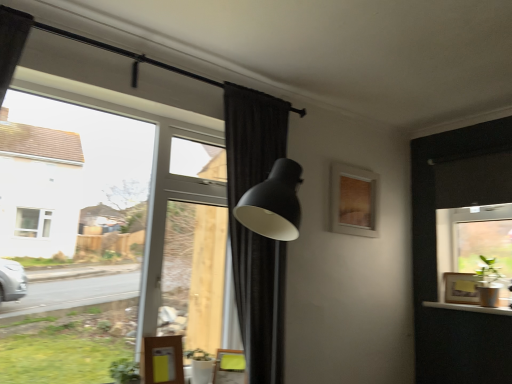
Question: Considering the relative sizes of yellow fabric swivel chair at lower center and transparent glass window at upper left, which is counted as the 2th window, starting from the right, in the image provided, is yellow fabric swivel chair at lower center wider than transparent glass window at upper left, which is counted as the 2th window, starting from the right,?

Choices:
 (A) no
 (B) yes

Answer: (A)

Question: Is the position of yellow fabric swivel chair at lower center less distant than that of transparent glass window at upper left, the 1th window when ordered from left to right?

Choices:
 (A) yes
 (B) no

Answer: (B)

Question: Could transparent glass window at upper left, which is counted as the 2th window, starting from the right, be considered to be inside yellow fabric swivel chair at lower center?

Choices:
 (A) no
 (B) yes

Answer: (A)

Question: Is yellow fabric swivel chair at lower center at the left side of transparent glass window at upper left, which is counted as the 2th window, starting from the right?

Choices:
 (A) no
 (B) yes

Answer: (A)

Question: Does yellow fabric swivel chair at lower center have a greater height compared to transparent glass window at upper left, which is counted as the 2th window, starting from the right?

Choices:
 (A) yes
 (B) no

Answer: (B)

Question: From a real-world perspective, is yellow fabric swivel chair at lower center physically above transparent glass window at upper left, which is counted as the 2th window, starting from the right?

Choices:
 (A) no
 (B) yes

Answer: (A)

Question: Does wooden picture frame at right, the 2th picture frame positioned from the top, lie in front of transparent glass window at upper left, the 1th window when ordered from left to right?

Choices:
 (A) yes
 (B) no

Answer: (B)

Question: From the image's perspective, is wooden picture frame at right, which appears as the 1th picture frame when ordered from the bottom, located beneath transparent glass window at upper left, the 1th window when ordered from left to right?

Choices:
 (A) yes
 (B) no

Answer: (A)

Question: Does wooden picture frame at right, which is counted as the 2th picture frame, starting from the left, have a larger size compared to transparent glass window at upper left, which is counted as the 2th window, starting from the right?

Choices:
 (A) yes
 (B) no

Answer: (B)

Question: Is wooden picture frame at right, which appears as the 1th picture frame when ordered from the bottom, completely or partially outside of transparent glass window at upper left, which is counted as the 2th window, starting from the right?

Choices:
 (A) no
 (B) yes

Answer: (B)

Question: Is transparent glass window at upper left, the 1th window when ordered from left to right, surrounded by wooden picture frame at right, which is counted as the 2th picture frame, starting from the left?

Choices:
 (A) no
 (B) yes

Answer: (A)

Question: Can you confirm if wooden picture frame at right, which appears as the 1th picture frame when ordered from the bottom, is shorter than transparent glass window at upper left, the 1th window when ordered from left to right?

Choices:
 (A) no
 (B) yes

Answer: (B)

Question: Can you confirm if transparent glass window at upper left, the 1th window when ordered from left to right, is positioned to the left of green matte plant at lower left?

Choices:
 (A) yes
 (B) no

Answer: (A)